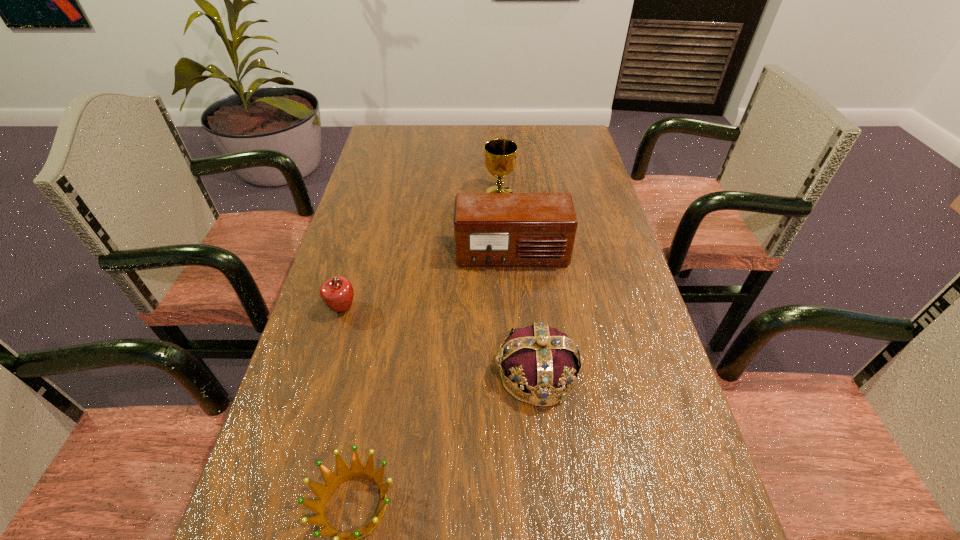
Identify the location of the farthest object. Image resolution: width=960 pixels, height=540 pixels. (500, 160).

Image resolution: width=960 pixels, height=540 pixels. In order to click on the second farthest object in this screenshot , I will do `click(490, 229)`.

Where is `the farther crown`? Image resolution: width=960 pixels, height=540 pixels. the farther crown is located at coordinates (541, 359).

Image resolution: width=960 pixels, height=540 pixels. What are the coordinates of `the taller crown` in the screenshot? It's located at coord(541,359).

Where is `the leftmost object`? the leftmost object is located at coordinates point(337,293).

This screenshot has height=540, width=960. Identify the location of apple. (337, 293).

Where is `vacant space positioned on the left of the farthest object`? The height and width of the screenshot is (540, 960). vacant space positioned on the left of the farthest object is located at coordinates (450, 193).

This screenshot has width=960, height=540. Find the location of `blank area located on the front-facing side of the fourth nearest object`. blank area located on the front-facing side of the fourth nearest object is located at coordinates (524, 408).

Find the location of a particular element. Image resolution: width=960 pixels, height=540 pixels. blank space located 0.160m on the front of the fourth farthest object is located at coordinates (551, 501).

Where is `vacant space located 0.200m on the back of the fourth tallest object`? vacant space located 0.200m on the back of the fourth tallest object is located at coordinates (362, 242).